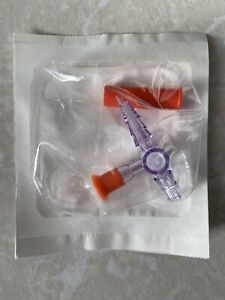
Where is `pattern in table`? pattern in table is located at coordinates (76, 274), (110, 263), (151, 261), (90, 21).